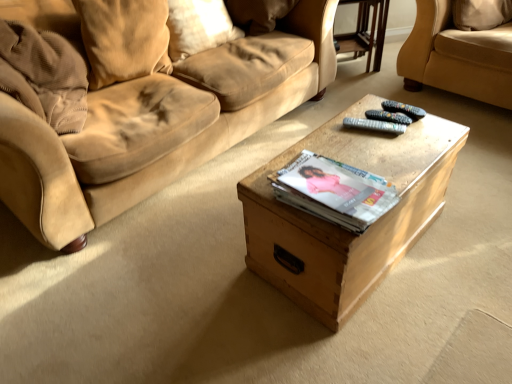
I want to click on free space to the right of wooden box at center, so click(466, 230).